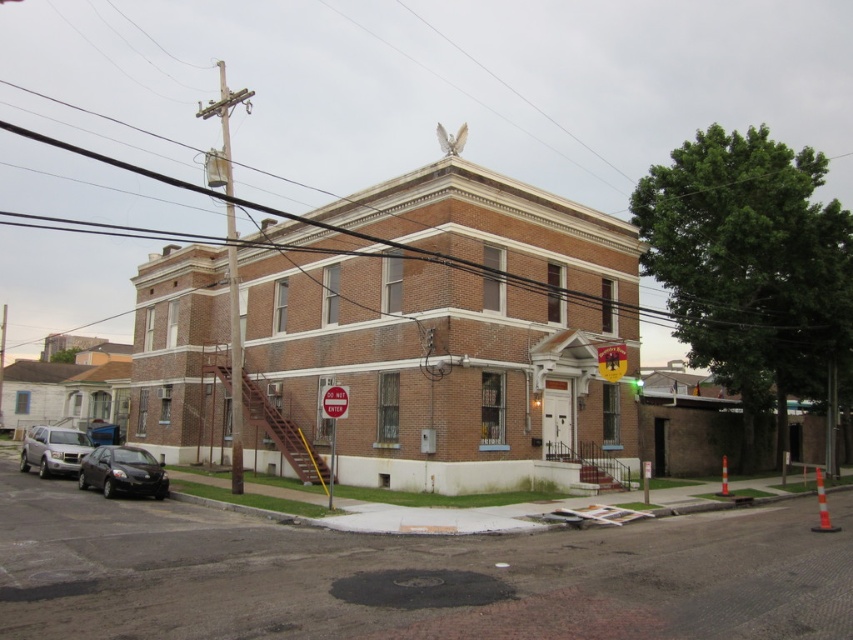
Who is positioned more to the left, matte black car at lower left or satin silver suv at lower left?

satin silver suv at lower left

Between point (131, 452) and point (20, 452), which one is positioned in front?

Point (131, 452)

This screenshot has height=640, width=853. Find the location of `matte black car at lower left`. matte black car at lower left is located at coordinates (122, 472).

Can you confirm if satin silver suv at lower left is taller than green glass traffic light at upper center?

Yes.

Is the position of satin silver suv at lower left less distant than that of green glass traffic light at upper center?

Yes, it is in front of green glass traffic light at upper center.

Based on the photo, who is more distant from viewer, (64, 444) or (636, 392)?

The point (636, 392) is more distant.

Identify the location of satin silver suv at lower left. The height and width of the screenshot is (640, 853). (53, 451).

Who is taller, matte black car at lower left or green glass traffic light at upper center?

With more height is matte black car at lower left.

Who is more distant from viewer, (132, 492) or (635, 381)?

The point (635, 381) is behind.

The width and height of the screenshot is (853, 640). I want to click on matte black car at lower left, so click(x=122, y=472).